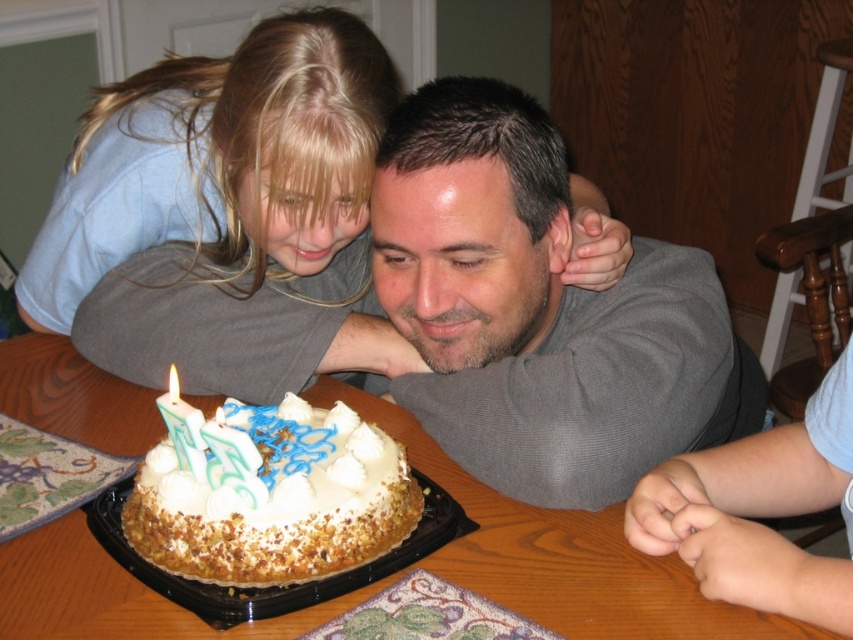
Who is shorter, wooden table at center or green wax candle at center?

green wax candle at center

Does wooden table at center appear on the right side of green wax candle at center?

Correct, you'll find wooden table at center to the right of green wax candle at center.

Between point (13, 358) and point (177, 417), which one is positioned behind?

The point (13, 358) is more distant.

Find the location of a particular element. The width and height of the screenshot is (853, 640). wooden table at center is located at coordinates (561, 556).

Does point (294, 260) come behind point (160, 410)?

Yes.

Which is below, blonde hair at upper left or green wax candle at center?

green wax candle at center is below.

Which is behind, point (186, 196) or point (178, 419)?

The point (186, 196) is more distant.

At what (x,y) coordinates should I click in order to perform the action: click on blonde hair at upper left. Please return your answer as a coordinate pair (x, y). The width and height of the screenshot is (853, 640). Looking at the image, I should click on (219, 161).

Does wooden table at center have a lesser height compared to white frosted cake at center?

Incorrect, wooden table at center's height does not fall short of white frosted cake at center's.

Which is behind, point (614, 544) or point (242, 420)?

Point (242, 420)

Identify the location of wooden table at center. This screenshot has width=853, height=640. (561, 556).